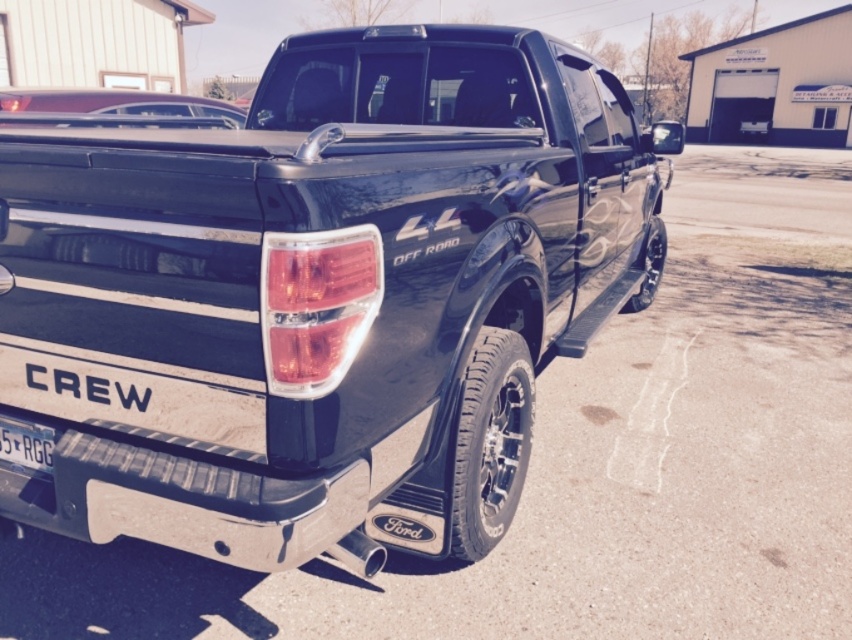
Which is more to the right, glossy black truck at center or matte black license plate at lower left?

glossy black truck at center

The width and height of the screenshot is (852, 640). Describe the element at coordinates (321, 294) in the screenshot. I see `glossy black truck at center` at that location.

Is point (324, 397) closer to viewer compared to point (49, 460)?

Yes, it is.

I want to click on glossy black truck at center, so click(x=321, y=294).